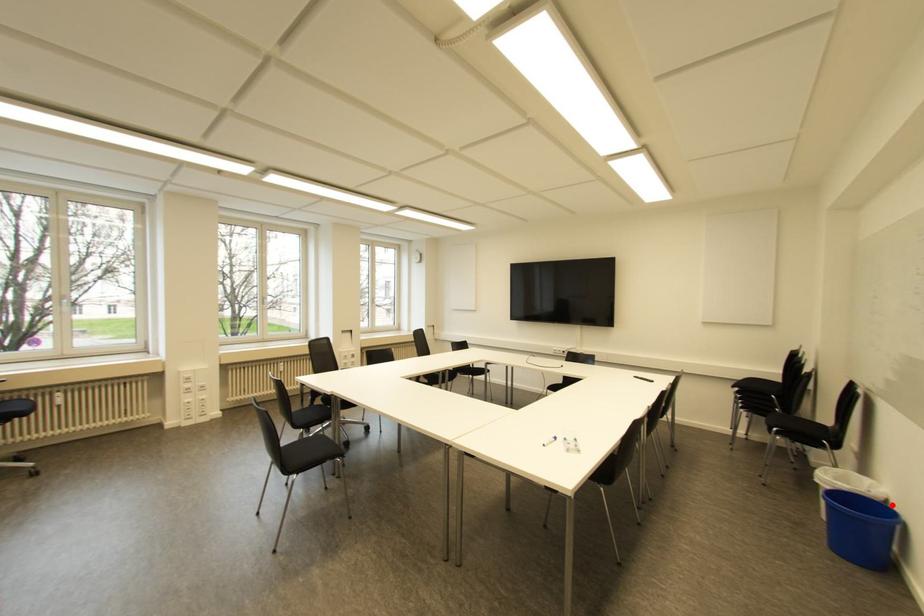
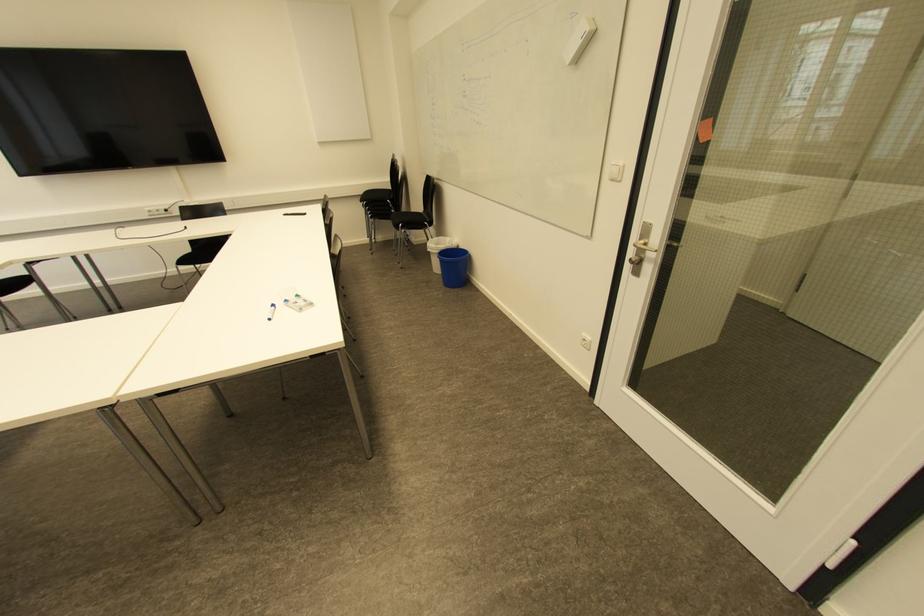
Question: I am providing you with two images of the same scene from different viewpoints. Given a red point in image1, look at the same physical point in image2. Is it:

Choices:
 (A) Closer to the viewpoint
 (B) Farther from the viewpoint

Answer: (A)